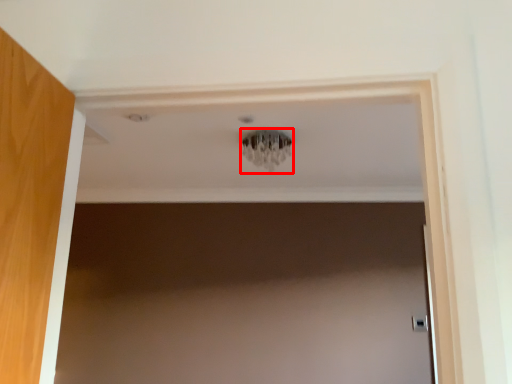
Question: From the image's perspective, where is light fixture (annotated by the red box) located relative to door handle?

Choices:
 (A) above
 (B) below

Answer: (A)